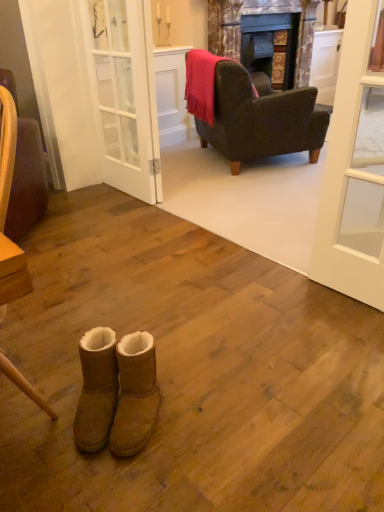
Question: Are white glass door at center and white glass door at upper right making contact?

Choices:
 (A) no
 (B) yes

Answer: (A)

Question: From a real-world perspective, does white glass door at center sit lower than white glass door at upper right?

Choices:
 (A) no
 (B) yes

Answer: (A)

Question: Considering the relative sizes of white glass door at center and white glass door at upper right in the image provided, is white glass door at center bigger than white glass door at upper right?

Choices:
 (A) no
 (B) yes

Answer: (B)

Question: Is white glass door at center to the right of white glass door at upper right from the viewer's perspective?

Choices:
 (A) no
 (B) yes

Answer: (A)

Question: Can you confirm if white glass door at center is shorter than white glass door at upper right?

Choices:
 (A) no
 (B) yes

Answer: (A)

Question: From a real-world perspective, relative to white glass door at center, is white glass door at upper right vertically above or below?

Choices:
 (A) above
 (B) below

Answer: (B)

Question: From their relative heights in the image, would you say white glass door at upper right is taller or shorter than white glass door at center?

Choices:
 (A) short
 (B) tall

Answer: (A)

Question: Relative to white glass door at center, is white glass door at upper right in front or behind?

Choices:
 (A) behind
 (B) front

Answer: (B)

Question: From the image's perspective, relative to white glass door at center, is white glass door at upper right above or below?

Choices:
 (A) above
 (B) below

Answer: (B)

Question: Considering the positions of white glass door at center and marble fireplace at center in the image, is white glass door at center taller or shorter than marble fireplace at center?

Choices:
 (A) short
 (B) tall

Answer: (B)

Question: From a real-world perspective, is white glass door at center positioned above or below marble fireplace at center?

Choices:
 (A) above
 (B) below

Answer: (B)

Question: Would you say white glass door at center is to the left or to the right of marble fireplace at center in the picture?

Choices:
 (A) right
 (B) left

Answer: (B)

Question: From the image's perspective, relative to marble fireplace at center, is white glass door at center above or below?

Choices:
 (A) above
 (B) below

Answer: (B)

Question: Looking at the image, does brown suede boots at lower center, placed as the first footwear when sorted from left to right, seem bigger or smaller compared to velvet purple chair at left, arranged as the first chair when viewed from the front?

Choices:
 (A) small
 (B) big

Answer: (A)

Question: From the image's perspective, is brown suede boots at lower center, which is counted as the second footwear, starting from the right, positioned above or below velvet purple chair at left, which appears as the first chair when viewed from the left?

Choices:
 (A) above
 (B) below

Answer: (B)